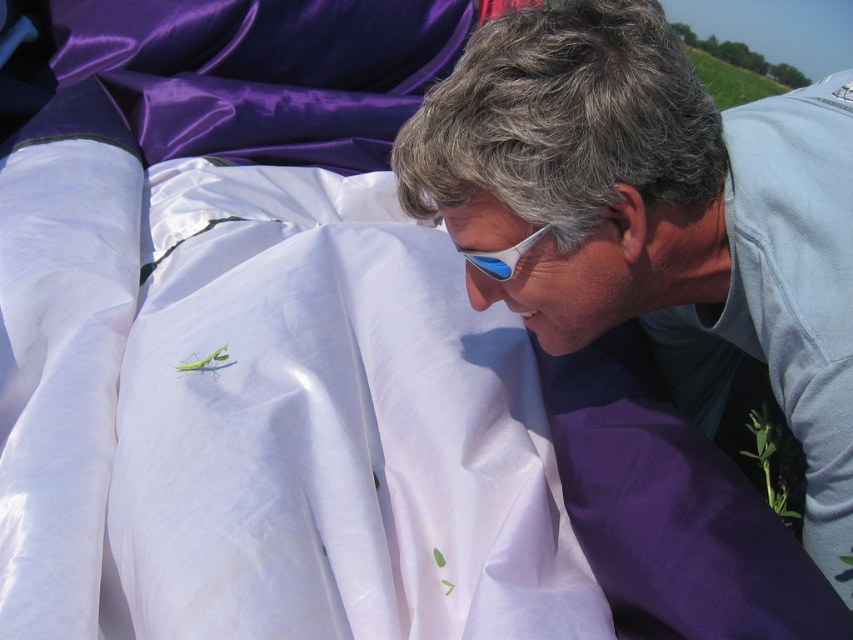
Question: Does white satin blanket at center appear on the left side of matte white shirt at center?

Choices:
 (A) no
 (B) yes

Answer: (B)

Question: Can you confirm if white satin blanket at center is thinner than white glossy goggles at upper center?

Choices:
 (A) yes
 (B) no

Answer: (B)

Question: Which point is closer to the camera?

Choices:
 (A) white satin blanket at center
 (B) white glossy goggles at upper center

Answer: (A)

Question: Among these objects, which one is nearest to the camera?

Choices:
 (A) white glossy goggles at upper center
 (B) white satin blanket at center

Answer: (B)

Question: Among these points, which one is farthest from the camera?

Choices:
 (A) (669, 230)
 (B) (479, 256)

Answer: (A)

Question: Is white satin blanket at center further to the viewer compared to white glossy goggles at upper center?

Choices:
 (A) no
 (B) yes

Answer: (A)